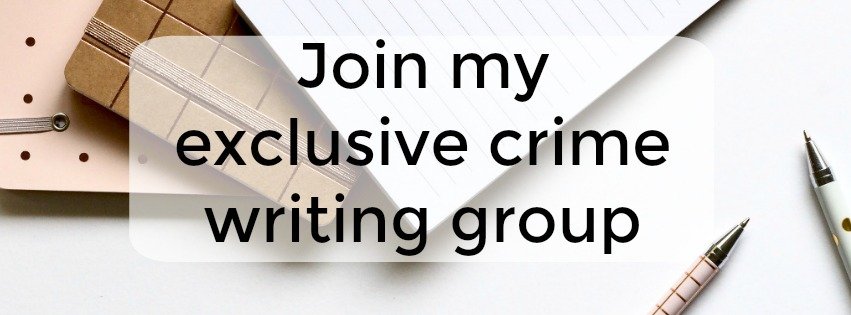
Where is `pen`? This screenshot has height=315, width=851. pen is located at coordinates (689, 286), (834, 209).